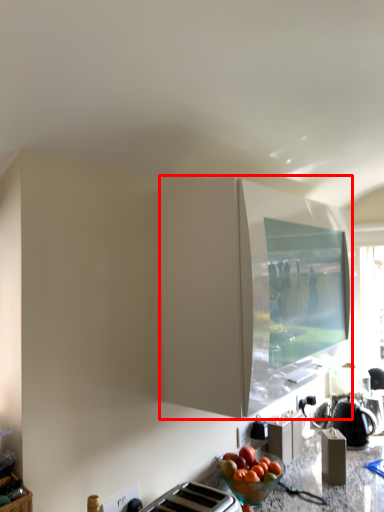
Question: From the image's perspective, considering the relative positions of cabinetry (annotated by the red box) and kettle in the image provided, where is cabinetry (annotated by the red box) located with respect to the staircase?

Choices:
 (A) below
 (B) above

Answer: (B)